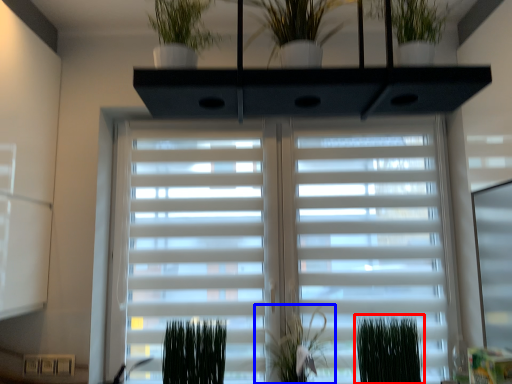
Question: Which of the following is the farthest to the observer, plant (highlighted by a red box) or plant (highlighted by a blue box)?

Choices:
 (A) plant
 (B) plant

Answer: (B)